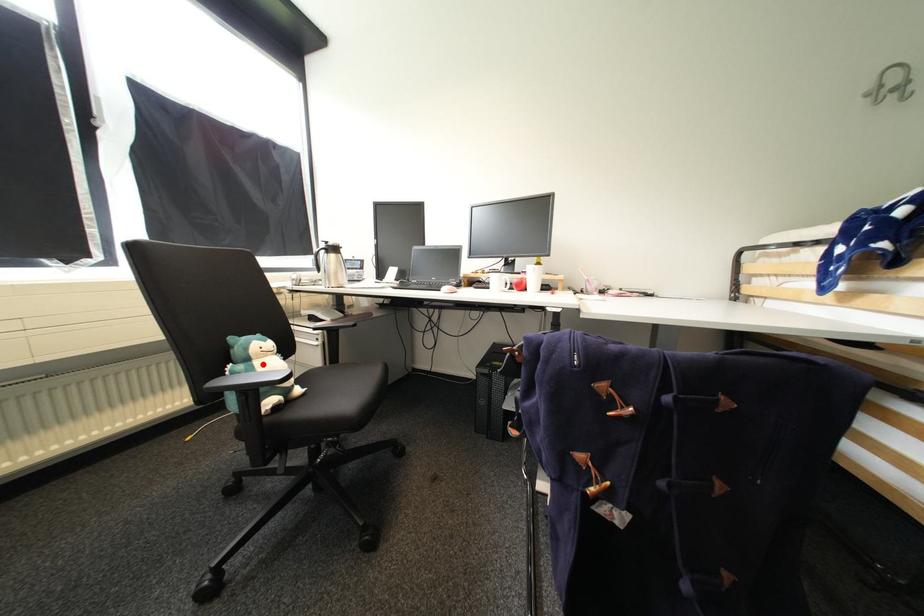
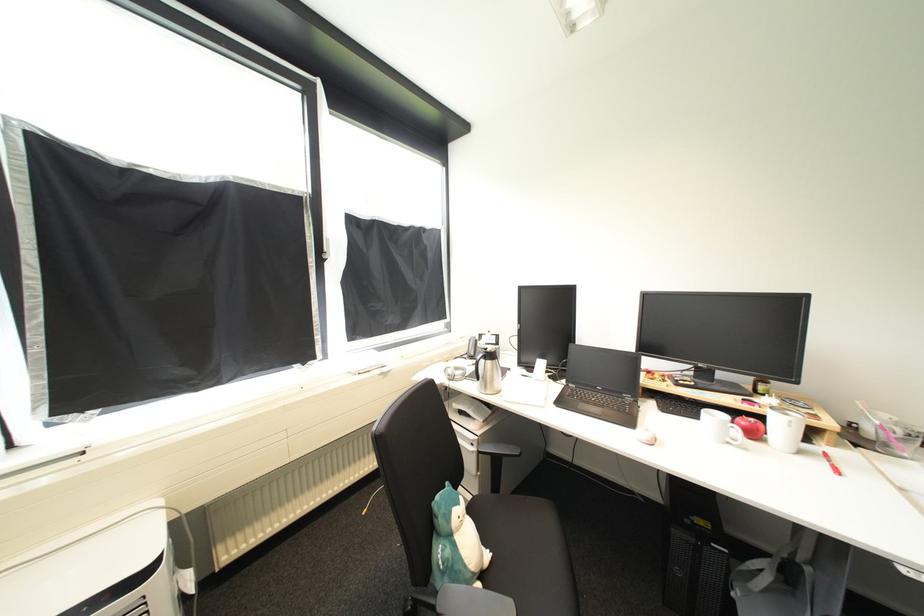
Question: I am providing you with two images of the same scene from different viewpoints. Given a red point in image1, look at the same physical point in image2. Is it:

Choices:
 (A) Closer to the viewpoint
 (B) Farther from the viewpoint

Answer: (B)